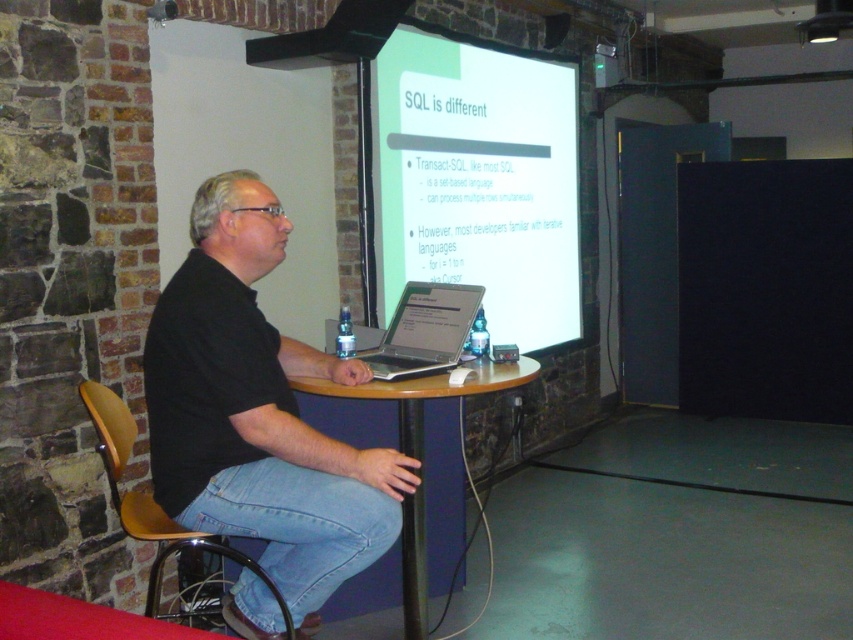
Between black matte shirt at center and silver metallic laptop at center, which one has less height?

With less height is silver metallic laptop at center.

Who is positioned more to the right, black matte shirt at center or silver metallic laptop at center?

From the viewer's perspective, silver metallic laptop at center appears more on the right side.

This screenshot has height=640, width=853. Describe the element at coordinates (258, 412) in the screenshot. I see `black matte shirt at center` at that location.

Locate an element on the screen. The height and width of the screenshot is (640, 853). black matte shirt at center is located at coordinates (258, 412).

Can you confirm if black matte shirt at center is smaller than brown wood chair at left?

Correct, black matte shirt at center occupies less space than brown wood chair at left.

Is black matte shirt at center to the left of brown wood chair at left from the viewer's perspective?

Incorrect, black matte shirt at center is not on the left side of brown wood chair at left.

Between point (293, 598) and point (170, 518), which one is positioned behind?

Point (170, 518)

Identify the location of black matte shirt at center. (258, 412).

Does white glossy projector screen at upper center have a greater width compared to silver metallic laptop at center?

Correct, the width of white glossy projector screen at upper center exceeds that of silver metallic laptop at center.

Identify the location of white glossy projector screen at upper center. The image size is (853, 640). (479, 180).

You are a GUI agent. You are given a task and a screenshot of the screen. Output one action in this format:
    pyautogui.click(x=<x>, y=<y>)
    Task: Click on the white glossy projector screen at upper center
    The height and width of the screenshot is (640, 853).
    Given the screenshot: What is the action you would take?
    pyautogui.click(x=479, y=180)